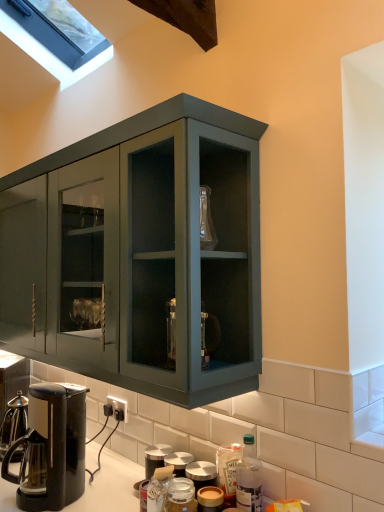
Measure the distance between point (254, 458) and camera.

Point (254, 458) is 4.29 feet from camera.

Identify the location of translucent plastic bottle at lower center, which is the third bottle in left-to-right order. Image resolution: width=384 pixels, height=512 pixels. coord(249,478).

Image resolution: width=384 pixels, height=512 pixels. I want to click on black glossy coffee maker at lower left, so click(51, 448).

Image resolution: width=384 pixels, height=512 pixels. I want to click on translucent plastic bottle at lower center, which is counted as the first bottle, starting from the right, so click(249, 478).

Does clear glass window at upper left have a larger size compared to translucent plastic bottle at lower center, which is counted as the first bottle, starting from the right?

Indeed, clear glass window at upper left has a larger size compared to translucent plastic bottle at lower center, which is counted as the first bottle, starting from the right.

Does clear glass window at upper left lie in front of translucent plastic bottle at lower center, which is the third bottle in left-to-right order?

No, clear glass window at upper left is further to the viewer.

Which is behind, point (41, 64) or point (243, 453)?

The point (41, 64) is behind.

From a real-world perspective, is clear glass window at upper left located higher than translucent plastic bottle at lower center, which is counted as the first bottle, starting from the right?

Yes, from a real-world perspective, clear glass window at upper left is over translucent plastic bottle at lower center, which is counted as the first bottle, starting from the right

Does point (49, 507) lie behind point (225, 467)?

Yes, it is behind point (225, 467).

In the scene shown: Is black glossy coffee maker at lower left at the left side of translucent plastic bottle at lower center, which is the second bottle in right-to-left order?

Indeed, black glossy coffee maker at lower left is positioned on the left side of translucent plastic bottle at lower center, which is the second bottle in right-to-left order.

From their relative heights in the image, would you say black glossy coffee maker at lower left is taller or shorter than translucent plastic bottle at lower center, which is the second bottle in right-to-left order?

black glossy coffee maker at lower left is taller than translucent plastic bottle at lower center, which is the second bottle in right-to-left order.

Identify the location of coffee maker above the translucent plastic bottle at lower center, which is the second bottle in right-to-left order (from the image's perspective). (51, 448).

Does black glossy coffee maker at lower left turn towards clear glass window at upper left?

No, black glossy coffee maker at lower left does not turn towards clear glass window at upper left.

From the image's perspective, is black glossy coffee maker at lower left beneath clear glass window at upper left?

Correct, black glossy coffee maker at lower left appears lower than clear glass window at upper left in the image.

Is black glossy coffee maker at lower left positioned before clear glass window at upper left?

Yes, it is in front of clear glass window at upper left.

Can you confirm if black glossy coffee maker at lower left is smaller than clear glass window at upper left?

Indeed, black glossy coffee maker at lower left has a smaller size compared to clear glass window at upper left.

Is point (95, 56) farther from viewer compared to point (24, 474)?

Yes, point (95, 56) is farther from viewer.

Could you tell me if clear glass window at upper left is turned towards black glossy coffee maker at lower left?

No, clear glass window at upper left is not facing towards black glossy coffee maker at lower left.

From a real-world perspective, who is located higher, clear glass window at upper left or black glossy coffee maker at lower left?

clear glass window at upper left, from a real-world perspective.

Can you see clear glass window at upper left touching black glossy coffee maker at lower left?

There is a gap between clear glass window at upper left and black glossy coffee maker at lower left.

How many degrees apart are the facing directions of translucent plastic bottle at lower center, which is counted as the first bottle, starting from the right, and black glossy coffee maker at lower left?

There is a 3.95-degree angle between the facing directions of translucent plastic bottle at lower center, which is counted as the first bottle, starting from the right, and black glossy coffee maker at lower left.

Locate an element on the screen. coffee maker above the translucent plastic bottle at lower center, which is counted as the first bottle, starting from the right (from the image's perspective) is located at coordinates pos(51,448).

Is the surface of translucent plastic bottle at lower center, which is counted as the first bottle, starting from the right, in direct contact with black glossy coffee maker at lower left?

No, translucent plastic bottle at lower center, which is counted as the first bottle, starting from the right, is not beside black glossy coffee maker at lower left.

Is translucent plastic bottle at lower center, which is counted as the first bottle, starting from the right, taller than black glossy coffee maker at lower left?

Incorrect, the height of translucent plastic bottle at lower center, which is counted as the first bottle, starting from the right, is not larger of that of black glossy coffee maker at lower left.

This screenshot has height=512, width=384. I want to click on the 2nd bottle positioned below the clear glass window at upper left (from a real-world perspective), so click(228, 471).

Is point (35, 51) farther from camera compared to point (234, 499)?

That is True.

Between clear glass window at upper left and translucent plastic bottle at lower center, which is the second bottle in right-to-left order, which one has smaller width?

translucent plastic bottle at lower center, which is the second bottle in right-to-left order, is thinner.

Can you confirm if translucent glass jar at lower center, which ranks as the third bottle in right-to-left order, is positioned to the right of clear glass window at upper left?

Correct, you'll find translucent glass jar at lower center, which ranks as the third bottle in right-to-left order, to the right of clear glass window at upper left.

Choose the correct answer: Is translucent glass jar at lower center, which ranks as the third bottle in right-to-left order, inside clear glass window at upper left or outside it?

translucent glass jar at lower center, which ranks as the third bottle in right-to-left order, is spatially situated outside clear glass window at upper left.

Does translucent glass jar at lower center, which ranks as the 1th bottle in left-to-right order, have a greater height compared to clear glass window at upper left?

No, translucent glass jar at lower center, which ranks as the 1th bottle in left-to-right order, is not taller than clear glass window at upper left.

Is translucent glass jar at lower center, which ranks as the 1th bottle in left-to-right order, in front of clear glass window at upper left?

Yes, the depth of translucent glass jar at lower center, which ranks as the 1th bottle in left-to-right order, is less than that of clear glass window at upper left.

I want to click on window to the left of translucent plastic bottle at lower center, which is the third bottle in left-to-right order, so click(x=50, y=54).

Starting from the black glossy coffee maker at lower left, which bottle is the 2nd one to the right? Please provide its 2D coordinates.

[(228, 471)]

Looking at this image, considering their positions, is black glossy coffee maker at lower left positioned further to translucent plastic bottle at lower center, which is the second bottle in right-to-left order, than clear glass window at upper left?

Among the two, clear glass window at upper left is located further to translucent plastic bottle at lower center, which is the second bottle in right-to-left order.

Looking at the image, which one is located closer to clear glass window at upper left, translucent plastic bottle at lower center, which is the second bottle in right-to-left order, or translucent plastic bottle at lower center, which is the third bottle in left-to-right order?

Based on the image, translucent plastic bottle at lower center, which is the second bottle in right-to-left order, appears to be nearer to clear glass window at upper left.

From the image, which object appears to be farther from black glossy coffee maker at lower left, translucent plastic bottle at lower center, which is counted as the first bottle, starting from the right, or translucent plastic bottle at lower center, the 2th bottle from the left?

translucent plastic bottle at lower center, which is counted as the first bottle, starting from the right, is positioned further to the anchor black glossy coffee maker at lower left.

Looking at the image, which one is located further to translucent glass jar at lower center, which ranks as the 1th bottle in left-to-right order, clear glass window at upper left or translucent plastic bottle at lower center, which is the third bottle in left-to-right order?

clear glass window at upper left is positioned further to the anchor translucent glass jar at lower center, which ranks as the 1th bottle in left-to-right order.

Estimate the real-world distances between objects in this image. Which object is closer to black glossy coffee maker at lower left, translucent plastic bottle at lower center, the 2th bottle from the left, or translucent plastic bottle at lower center, which is the third bottle in left-to-right order?

translucent plastic bottle at lower center, the 2th bottle from the left, is positioned closer to the anchor black glossy coffee maker at lower left.

Based on their spatial positions, is clear glass window at upper left or translucent plastic bottle at lower center, which is counted as the first bottle, starting from the right, closer to translucent plastic bottle at lower center, which is the second bottle in right-to-left order?

translucent plastic bottle at lower center, which is counted as the first bottle, starting from the right, is closer to translucent plastic bottle at lower center, which is the second bottle in right-to-left order.

Which object lies nearer to the anchor point black glossy coffee maker at lower left, translucent glass jar at lower center, which ranks as the 1th bottle in left-to-right order, or clear glass window at upper left?

translucent glass jar at lower center, which ranks as the 1th bottle in left-to-right order, is positioned closer to the anchor black glossy coffee maker at lower left.

Looking at the image, which one is located further to translucent plastic bottle at lower center, which is the third bottle in left-to-right order, translucent glass jar at lower center, which ranks as the third bottle in right-to-left order, or black glossy coffee maker at lower left?

Among the two, black glossy coffee maker at lower left is located further to translucent plastic bottle at lower center, which is the third bottle in left-to-right order.

The image size is (384, 512). Find the location of `coffee maker that lies between clear glass window at upper left and translucent plastic bottle at lower center, the 2th bottle from the left, from top to bottom`. coffee maker that lies between clear glass window at upper left and translucent plastic bottle at lower center, the 2th bottle from the left, from top to bottom is located at coordinates (51, 448).

This screenshot has width=384, height=512. What are the coordinates of `bottle between translucent glass jar at lower center, which ranks as the 1th bottle in left-to-right order, and translucent plastic bottle at lower center, which is counted as the first bottle, starting from the right, from left to right` in the screenshot? It's located at (228, 471).

The height and width of the screenshot is (512, 384). Identify the location of bottle between clear glass window at upper left and translucent plastic bottle at lower center, the 2th bottle from the left, vertically. (249, 478).

Locate an element on the screen. This screenshot has height=512, width=384. coffee maker that lies between clear glass window at upper left and translucent glass jar at lower center, which ranks as the third bottle in right-to-left order, from top to bottom is located at coordinates (51, 448).